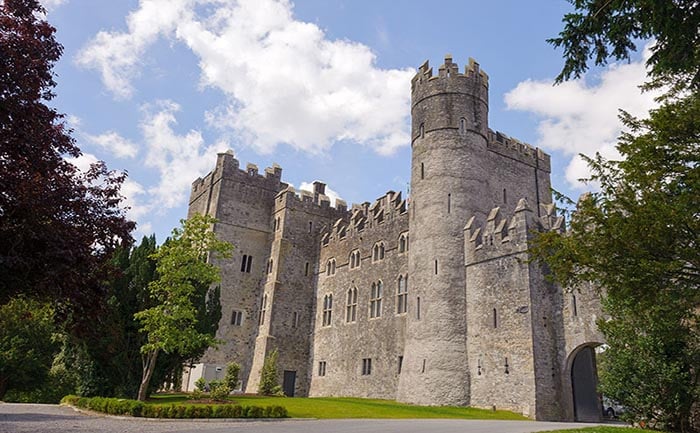
In order to click on archway in this screenshot , I will do `click(580, 346)`.